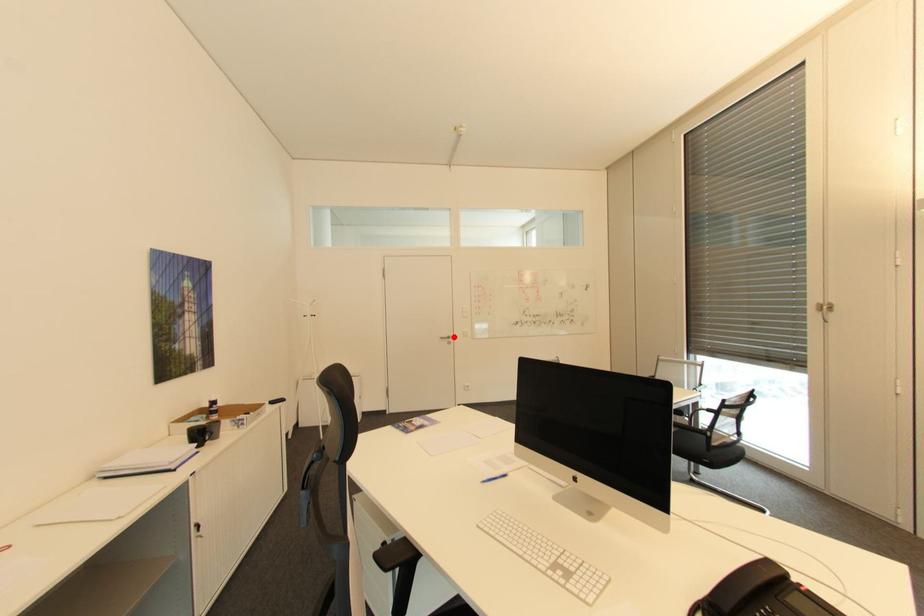
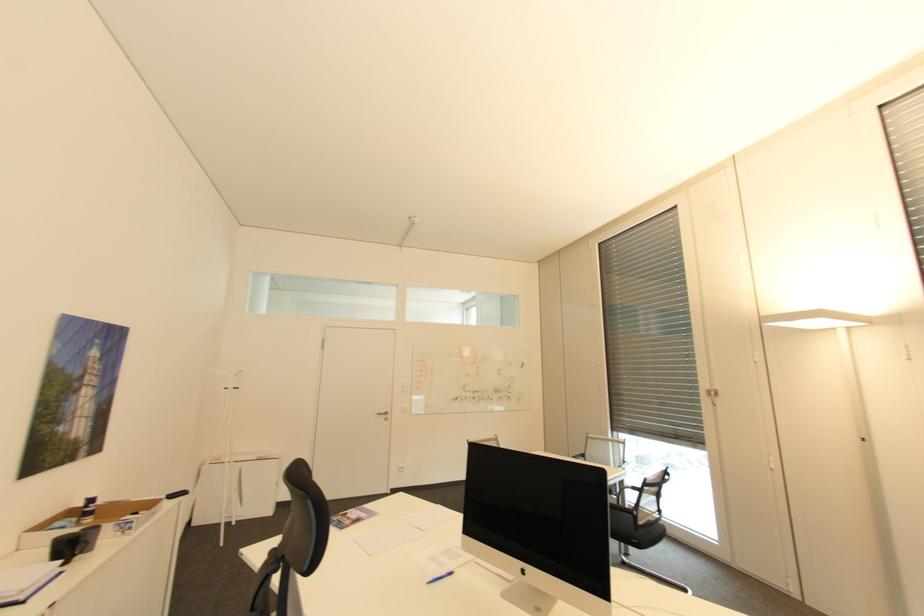
In the second image, find the point that corresponds to the highlighted location in the first image.

(391, 413)